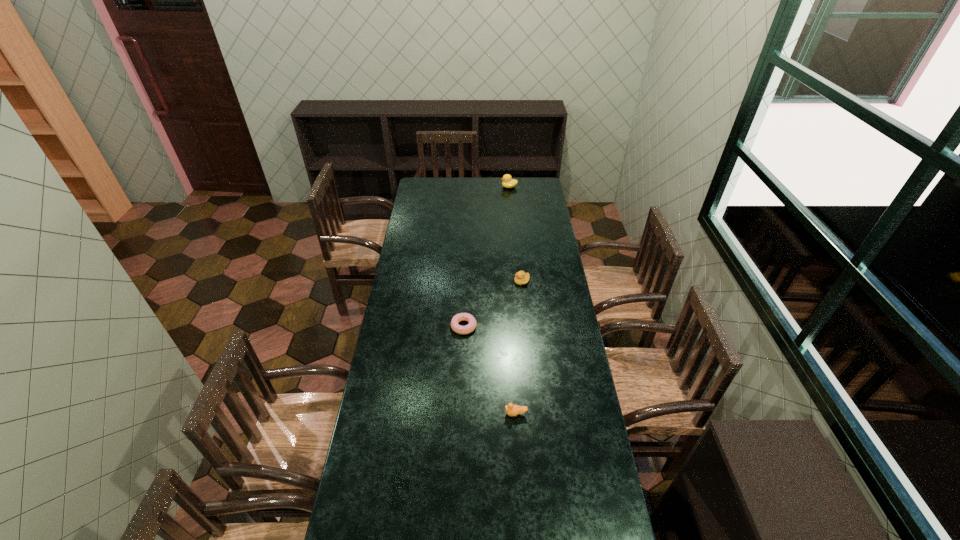
Identify which object is located as the third nearest to the nearest duckling. Please provide its 2D coordinates. Your answer should be formatted as a tuple, i.e. [(x, y)], where the tuple contains the x and y coordinates of a point satisfying the conditions above.

[(508, 182)]

Point out which object is positioned as the nearest to the leftmost object. Please provide its 2D coordinates. Your answer should be formatted as a tuple, i.e. [(x, y)], where the tuple contains the x and y coordinates of a point satisfying the conditions above.

[(521, 278)]

Where is `duckling identified as the closest to the doughnut`? Image resolution: width=960 pixels, height=540 pixels. duckling identified as the closest to the doughnut is located at coordinates (521, 278).

Point out which duckling is positioned as the second nearest to the second farthest object. Please provide its 2D coordinates. Your answer should be formatted as a tuple, i.e. [(x, y)], where the tuple contains the x and y coordinates of a point satisfying the conditions above.

[(508, 182)]

Locate an element on the screen. The height and width of the screenshot is (540, 960). free spot that satisfies the following two spatial constraints: 1. on the beak of the tallest duckling; 2. on the front side of the second nearest object is located at coordinates (522, 326).

This screenshot has width=960, height=540. What are the coordinates of `vacant space that satisfies the following two spatial constraints: 1. on the beak of the second farthest object; 2. on the front side of the second nearest object` in the screenshot? It's located at (527, 326).